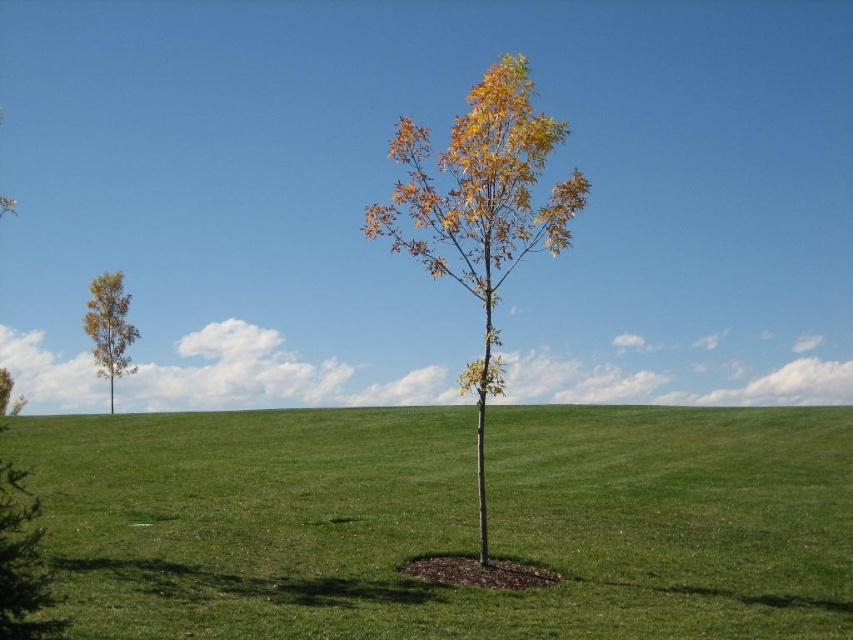
You are standing in the outdoor scene and want to walk towards the smooth brown tree at left. Which direction should you move relative to the green grassy at center?

Since the green grassy at center is closer to the viewer than the smooth brown tree at left, you should move away from the green grassy at center to reach the smooth brown tree at left.

You are a gardener who wants to plant a new tree in the green grassy area at center. The new tree you have is the same size as the smooth brown tree at left. Based on the current height of the green grassy at center, will the new tree be visible from above the grass?

The green grassy at center is shorter than the smooth brown tree at left. Since the new tree is the same size as the smooth brown tree at left, it will also be taller than the grass, making it visible from above the grass.